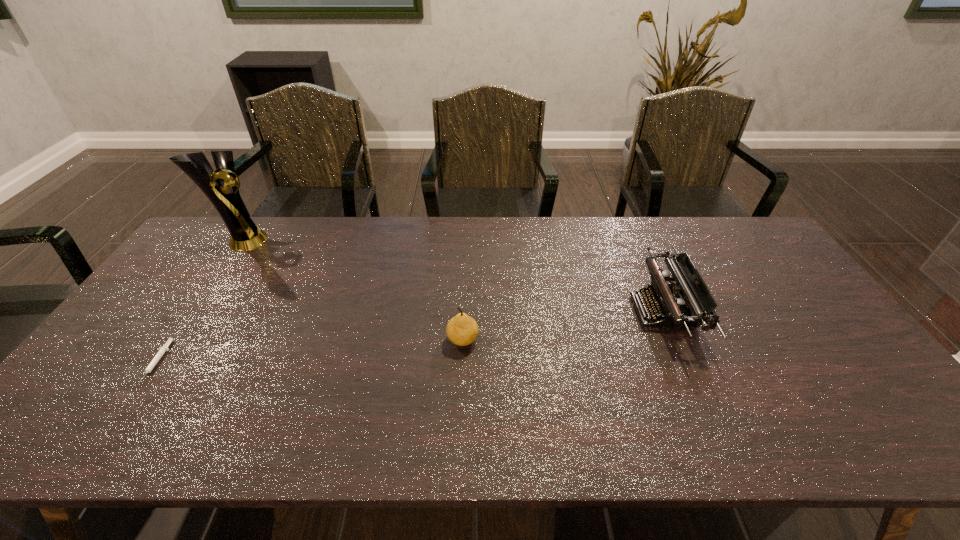
Image resolution: width=960 pixels, height=540 pixels. What are the coordinates of `vacant region that satisfies the following two spatial constraints: 1. at the front of the farthest object, where the globe is visible; 2. on the back side of the pear` in the screenshot? It's located at (173, 340).

In order to click on free space that satisfies the following two spatial constraints: 1. at the front of the award, where the globe is visible; 2. on the front side of the syringe in this screenshot , I will do `click(157, 363)`.

Find the location of a particular element. This screenshot has height=540, width=960. free space that satisfies the following two spatial constraints: 1. on the back side of the shortest object; 2. on the left side of the pear is located at coordinates (173, 340).

Locate an element on the screen. This screenshot has height=540, width=960. vacant space that satisfies the following two spatial constraints: 1. at the front of the second object from right to left, where the globe is visible; 2. on the right side of the farthest object is located at coordinates (173, 340).

At what (x,y) coordinates should I click in order to perform the action: click on free region that satisfies the following two spatial constraints: 1. at the front of the tallest object, where the globe is visible; 2. on the left side of the third object from left to right. Please return your answer as a coordinate pair (x, y). The height and width of the screenshot is (540, 960). Looking at the image, I should click on (173, 340).

I want to click on free location that satisfies the following two spatial constraints: 1. on the typing side of the rightmost object; 2. on the front side of the syringe, so click(685, 363).

You are a GUI agent. You are given a task and a screenshot of the screen. Output one action in this format:
    pyautogui.click(x=<x>, y=<y>)
    Task: Click on the free spot that satisfies the following two spatial constraints: 1. at the front of the award, where the globe is visible; 2. on the right side of the second object from right to left
    This screenshot has height=540, width=960.
    Given the screenshot: What is the action you would take?
    pyautogui.click(x=173, y=340)